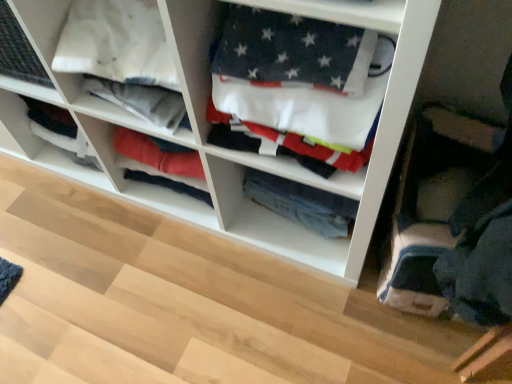
The image size is (512, 384). In order to click on vacant space to the left of denim jeans at center, arranged as the 1th clothing when viewed from the back in this screenshot , I will do `click(257, 228)`.